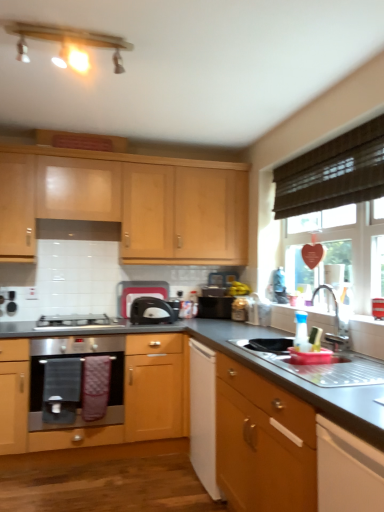
This screenshot has width=384, height=512. Describe the element at coordinates (138, 293) in the screenshot. I see `black plastic toaster at center, arranged as the first appliance when viewed from the left` at that location.

The width and height of the screenshot is (384, 512). I want to click on black fabric screen door at lower left, so click(61, 390).

The image size is (384, 512). I want to click on stainless steel sink at lower right, so click(320, 362).

This screenshot has height=512, width=384. What do you see at coordinates (78, 321) in the screenshot?
I see `satin silver gas stove at lower left` at bounding box center [78, 321].

The image size is (384, 512). Describe the element at coordinates (67, 42) in the screenshot. I see `matte wood light fixture at upper center` at that location.

At what (x,y) coordinates should I click in order to perform the action: click on black plastic toaster at center, arranged as the first appliance when viewed from the left. Please return your answer as a coordinate pair (x, y). Looking at the image, I should click on (138, 293).

Where is `sink that appears on the right of satin silver gas stove at lower left`? sink that appears on the right of satin silver gas stove at lower left is located at coordinates (320, 362).

Which is closer to the camera, [42,319] or [330,340]?

Positioned in front is point [330,340].

Is satin silver gas stove at lower left positioned with its back to stainless steel sink at lower right?

No, stainless steel sink at lower right is not at the back of satin silver gas stove at lower left.

In terms of size, does satin silver gas stove at lower left appear bigger or smaller than stainless steel sink at lower right?

In the image, satin silver gas stove at lower left appears to be smaller than stainless steel sink at lower right.

Is satin silver gas stove at lower left far away from smooth gray countertop at center?

No, there isn't a large distance between satin silver gas stove at lower left and smooth gray countertop at center.

Is satin silver gas stove at lower left closer to the viewer compared to smooth gray countertop at center?

That is False.

Is smooth gray countertop at center at the back of satin silver gas stove at lower left?

satin silver gas stove at lower left is not turned away from smooth gray countertop at center.

Visually, is black plastic toaster at center, placed as the 1th appliance when sorted from right to left, positioned to the left or to the right of satin silver gas stove at lower left?

black plastic toaster at center, placed as the 1th appliance when sorted from right to left, is to the right of satin silver gas stove at lower left.

Does point (201, 307) appear closer or farther from the camera than point (77, 314)?

Point (201, 307) appears to be farther away from the viewer than point (77, 314).

Is black plastic toaster at center, the 2th appliance when ordered from left to right, positioned far away from satin silver gas stove at lower left?

No, there isn't a large distance between black plastic toaster at center, the 2th appliance when ordered from left to right, and satin silver gas stove at lower left.

From a real-world perspective, is black plastic toaster at center, placed as the 1th appliance when sorted from right to left, positioned above or below satin silver gas stove at lower left?

Clearly, from a real-world perspective, black plastic toaster at center, placed as the 1th appliance when sorted from right to left, is above satin silver gas stove at lower left.

Is light wood cabinet at upper center, the first cabinetry viewed from the top, turned away from satin black toaster at center?

No.

Is light wood cabinet at upper center, the second cabinetry when ordered from bottom to top, next to satin black toaster at center?

No, light wood cabinet at upper center, the second cabinetry when ordered from bottom to top, is not next to satin black toaster at center.

Identify the location of cabinetry above the satin black toaster at center (from the image's perspective). The image size is (384, 512). (127, 203).

Would you consider wooden cabinet at lower right, the second cabinetry when ordered from left to right, to be distant from black fabric screen door at lower left?

Indeed, wooden cabinet at lower right, the second cabinetry when ordered from left to right, is not near black fabric screen door at lower left.

From a real-world perspective, between wooden cabinet at lower right, the second cabinetry when ordered from left to right, and black fabric screen door at lower left, who is vertically higher?

black fabric screen door at lower left.

How much distance is there between wooden cabinet at lower right, the second cabinetry when ordered from left to right, and black fabric screen door at lower left?

wooden cabinet at lower right, the second cabinetry when ordered from left to right, is 1.30 meters from black fabric screen door at lower left.

Between wooden cabinet at lower right, the second cabinetry when ordered from left to right, and black fabric screen door at lower left, which one is positioned in front?

wooden cabinet at lower right, the second cabinetry when ordered from left to right, is more forward.

Which object is positioned more to the right, satin black toaster at center or light wood cabinet at upper center, the first cabinetry viewed from the top?

From the viewer's perspective, satin black toaster at center appears more on the right side.

Considering the sizes of satin black toaster at center and light wood cabinet at upper center, the second cabinetry when ordered from bottom to top, in the image, is satin black toaster at center taller or shorter than light wood cabinet at upper center, the second cabinetry when ordered from bottom to top,?

Clearly, satin black toaster at center is shorter compared to light wood cabinet at upper center, the second cabinetry when ordered from bottom to top.

Based on their sizes in the image, would you say satin black toaster at center is bigger or smaller than light wood cabinet at upper center, placed as the first cabinetry when sorted from back to front?

In the image, satin black toaster at center appears to be smaller than light wood cabinet at upper center, placed as the first cabinetry when sorted from back to front.

Measure the distance from smooth gray countertop at center to satin black toaster at center.

smooth gray countertop at center and satin black toaster at center are 25.67 inches apart from each other.

Looking at this image, is smooth gray countertop at center looking in the opposite direction of satin black toaster at center?

No.

In the scene shown: Considering the relative positions of smooth gray countertop at center and satin black toaster at center in the image provided, is smooth gray countertop at center in front of satin black toaster at center?

Yes, it is.

Which of these two, smooth gray countertop at center or satin black toaster at center, is bigger?

smooth gray countertop at center.

You are a GUI agent. You are given a task and a screenshot of the screen. Output one action in this format:
    pyautogui.click(x=<x>, y=<y>)
    Task: Click on the sink located on the right of satin silver gas stove at lower left
    
    Given the screenshot: What is the action you would take?
    pyautogui.click(x=320, y=362)

This screenshot has width=384, height=512. Find the location of `countertop below the satin silver gas stove at lower left (from the image's perspective)`. countertop below the satin silver gas stove at lower left (from the image's perspective) is located at coordinates (183, 395).

Which object lies further to the anchor point black plastic toaster at center, placed as the 1th appliance when sorted from right to left, light wood cabinet at upper center, placed as the first cabinetry when sorted from back to front, or matte wood light fixture at upper center?

matte wood light fixture at upper center is positioned further to the anchor black plastic toaster at center, placed as the 1th appliance when sorted from right to left.

Estimate the real-world distances between objects in this image. Which object is closer to black plastic toaster at center, placed as the 1th appliance when sorted from right to left, stainless steel oven at lower left or black plastic toaster at center, arranged as the second appliance when viewed from the right?

Based on the image, black plastic toaster at center, arranged as the second appliance when viewed from the right, appears to be nearer to black plastic toaster at center, placed as the 1th appliance when sorted from right to left.

Looking at the image, which one is located further to light wood cabinet at upper center, the 2th cabinetry viewed from the right, silver metallic faucet at sink right or black plastic toaster at center, the 2th appliance when ordered from left to right?

silver metallic faucet at sink right is further to light wood cabinet at upper center, the 2th cabinetry viewed from the right.

Which object lies nearer to the anchor point smooth gray countertop at center, yellow matte bananas at center or light wood cabinet at upper center, the first cabinetry viewed from the top?

light wood cabinet at upper center, the first cabinetry viewed from the top, lies closer to smooth gray countertop at center than the other object.

Based on their spatial positions, is silver metallic faucet at sink right or satin black toaster at center further from black plastic toaster at center, arranged as the second appliance when viewed from the right?

silver metallic faucet at sink right lies further to black plastic toaster at center, arranged as the second appliance when viewed from the right, than the other object.

Based on their spatial positions, is smooth gray countertop at center or black plastic toaster at center, the 2th appliance when ordered from left to right, further from wooden cabinet at lower right, arranged as the first cabinetry when ordered from the bottom?

black plastic toaster at center, the 2th appliance when ordered from left to right, is further to wooden cabinet at lower right, arranged as the first cabinetry when ordered from the bottom.

From the image, which object appears to be farther from stainless steel sink at lower right, black fabric screen door at lower left or yellow matte bananas at center?

black fabric screen door at lower left lies further to stainless steel sink at lower right than the other object.

Looking at this image, based on their spatial positions, is black plastic toaster at center, the 2th appliance when ordered from left to right, or black fabric screen door at lower left closer to satin black toaster at center?

black plastic toaster at center, the 2th appliance when ordered from left to right, is closer to satin black toaster at center.

Locate an element on the screen. light fixture positioned between wooden cabinet at lower right, positioned as the first cabinetry in right-to-left order, and yellow matte bananas at center from near to far is located at coordinates (67, 42).

The height and width of the screenshot is (512, 384). I want to click on kitchen appliance between light wood cabinet at upper center, the 1th cabinetry viewed from the left, and black fabric screen door at lower left, in the vertical direction, so coord(151,311).

At what (x,y) coordinates should I click in order to perform the action: click on oven located between stainless steel sink at lower right and light wood cabinet at upper center, the 1th cabinetry viewed from the left, in the depth direction. Please return your answer as a coordinate pair (x, y). Looking at the image, I should click on (76, 382).

You are a GUI agent. You are given a task and a screenshot of the screen. Output one action in this format:
    pyautogui.click(x=<x>, y=<y>)
    Task: Click on the gas stove between light wood cabinet at upper center, placed as the first cabinetry when sorted from back to front, and stainless steel oven at lower left, in the vertical direction
    This screenshot has height=512, width=384.
    Given the screenshot: What is the action you would take?
    [x=78, y=321]